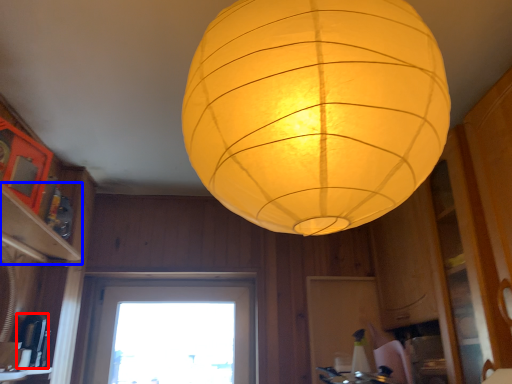
Question: Among these objects, which one is nearest to the camera, appliance (highlighted by a red box) or shelf (highlighted by a blue box)?

Choices:
 (A) appliance
 (B) shelf

Answer: (B)